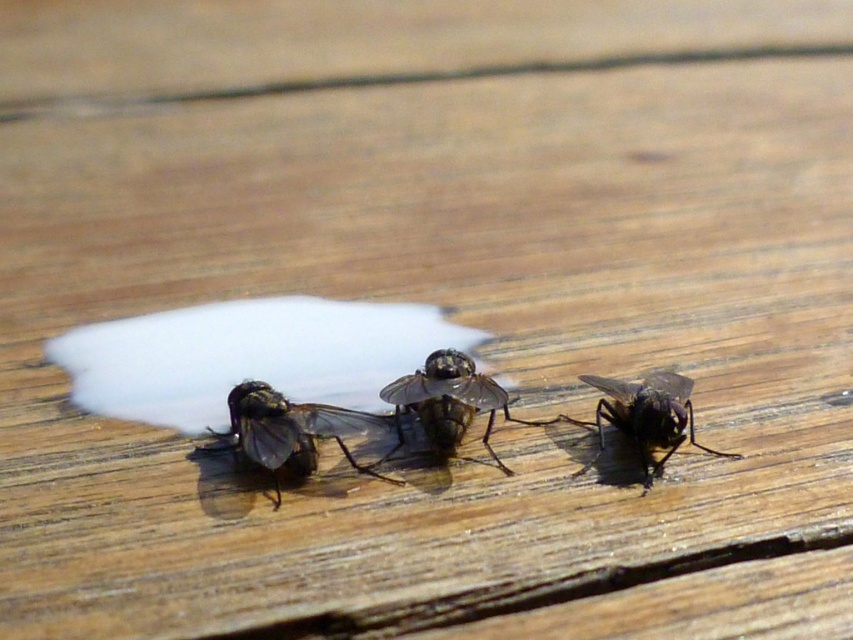
Question: Estimate the real-world distances between objects in this image. Which object is closer to the translucent dark at center?

Choices:
 (A) shiny black fly at center
 (B) black glossy fly at center

Answer: (A)

Question: Does translucent dark at center lie behind shiny black fly at center?

Choices:
 (A) no
 (B) yes

Answer: (A)

Question: Which point is farther to the camera?

Choices:
 (A) (236, 420)
 (B) (641, 444)

Answer: (B)

Question: Can you confirm if translucent dark at center is smaller than black glossy fly at center?

Choices:
 (A) yes
 (B) no

Answer: (B)

Question: Is shiny black fly at center thinner than black glossy fly at center?

Choices:
 (A) yes
 (B) no

Answer: (B)

Question: Among these objects, which one is farthest from the camera?

Choices:
 (A) translucent dark at center
 (B) shiny black fly at center
 (C) black glossy fly at center

Answer: (B)